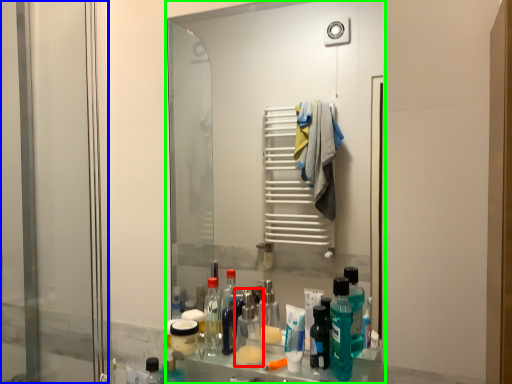
Question: Which is farther away from mouthwash (highlighted by a red box)? screen door (highlighted by a blue box) or mirror (highlighted by a green box)?

Choices:
 (A) screen door
 (B) mirror

Answer: (B)